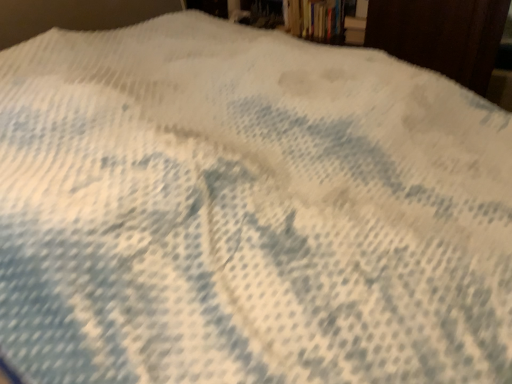
This screenshot has width=512, height=384. What do you see at coordinates (354, 30) in the screenshot?
I see `hardcover book at upper right` at bounding box center [354, 30].

Image resolution: width=512 pixels, height=384 pixels. I want to click on hardcover book at upper right, so click(354, 30).

The width and height of the screenshot is (512, 384). Describe the element at coordinates (315, 19) in the screenshot. I see `hardcover book at upper center` at that location.

Image resolution: width=512 pixels, height=384 pixels. I want to click on hardcover book at upper center, so click(315, 19).

At what (x,y) coordinates should I click in order to perform the action: click on hardcover book at upper right. Please return your answer as a coordinate pair (x, y). Looking at the image, I should click on (354, 30).

Does hardcover book at upper center appear on the right side of hardcover book at upper right?

No.

Is hardcover book at upper center positioned behind hardcover book at upper right?

That is True.

Considering the points (327, 7) and (347, 21), which point is in front, point (327, 7) or point (347, 21)?

The point (347, 21) is closer.

From the image's perspective, between hardcover book at upper center and hardcover book at upper right, which one is located above?

hardcover book at upper center appears higher in the image.

Consider the image. From a real-world perspective, is hardcover book at upper center on hardcover book at upper right?

Yes, from a real-world perspective, hardcover book at upper center is over hardcover book at upper right

Considering the relative sizes of hardcover book at upper center and hardcover book at upper right in the image provided, is hardcover book at upper center thinner than hardcover book at upper right?

No.

Does hardcover book at upper center have a lesser height compared to hardcover book at upper right?

In fact, hardcover book at upper center may be taller than hardcover book at upper right.

Consider the image. Considering the sizes of objects hardcover book at upper center and hardcover book at upper right in the image provided, who is bigger, hardcover book at upper center or hardcover book at upper right?

hardcover book at upper center.

Is hardcover book at upper center not inside hardcover book at upper right?

Yes.

Is hardcover book at upper center far from hardcover book at upper right?

No, hardcover book at upper center is not far from hardcover book at upper right.

Is hardcover book at upper center turned away from hardcover book at upper right?

No, hardcover book at upper center is not facing the opposite direction of hardcover book at upper right.

How far apart are hardcover book at upper center and hardcover book at upper right?

hardcover book at upper center is 6.87 inches from hardcover book at upper right.

At what (x,y) coordinates should I click in order to perform the action: click on paperback book located below the hardcover book at upper center (from the image's perspective). Please return your answer as a coordinate pair (x, y). The height and width of the screenshot is (384, 512). Looking at the image, I should click on (354, 30).

Does hardcover book at upper right appear on the right side of hardcover book at upper center?

Yes.

Considering the relative positions of hardcover book at upper right and hardcover book at upper center in the image provided, is hardcover book at upper right behind hardcover book at upper center?

No, hardcover book at upper right is closer to the viewer.

Which is behind, point (358, 19) or point (330, 32)?

The point (330, 32) is more distant.

Based on the photo, from the image's perspective, is hardcover book at upper right located above or below hardcover book at upper center?

hardcover book at upper right is below hardcover book at upper center.

From a real-world perspective, which is physically below, hardcover book at upper right or hardcover book at upper center?

hardcover book at upper right.

Considering the sizes of objects hardcover book at upper right and hardcover book at upper center in the image provided, who is thinner, hardcover book at upper right or hardcover book at upper center?

With smaller width is hardcover book at upper right.

Who is shorter, hardcover book at upper right or hardcover book at upper center?

With less height is hardcover book at upper right.

Considering the relative sizes of hardcover book at upper right and hardcover book at upper center in the image provided, is hardcover book at upper right smaller than hardcover book at upper center?

Correct, hardcover book at upper right occupies less space than hardcover book at upper center.

Is hardcover book at upper right not inside hardcover book at upper center?

That's correct, hardcover book at upper right is outside of hardcover book at upper center.

Is hardcover book at upper right directly adjacent to hardcover book at upper center?

hardcover book at upper right and hardcover book at upper center are clearly separated.

Looking at this image, is hardcover book at upper right oriented towards hardcover book at upper center?

No, hardcover book at upper right is not aimed at hardcover book at upper center.

How many degrees apart are the facing directions of hardcover book at upper right and hardcover book at upper center?

They differ by 8.88e-05 degrees in their facing directions.

Where is `paperback book located below the hardcover book at upper center (from the image's perspective)`? This screenshot has width=512, height=384. paperback book located below the hardcover book at upper center (from the image's perspective) is located at coordinates (354, 30).

At what (x,y) coordinates should I click in order to perform the action: click on book lying above the hardcover book at upper right (from the image's perspective). Please return your answer as a coordinate pair (x, y). Looking at the image, I should click on (315, 19).

At what (x,y) coordinates should I click in order to perform the action: click on book that is above the hardcover book at upper right (from a real-world perspective). Please return your answer as a coordinate pair (x, y). This screenshot has width=512, height=384. Looking at the image, I should click on (315, 19).